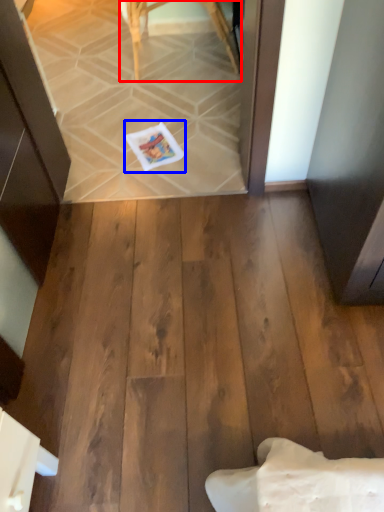
Question: Which of the following is the farthest to the observer, furniture (highlighted by a red box) or postcard (highlighted by a blue box)?

Choices:
 (A) furniture
 (B) postcard

Answer: (A)